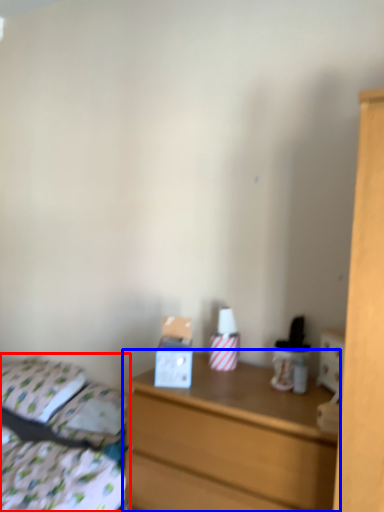
Question: Among these objects, which one is farthest to the camera, bed (highlighted by a red box) or chest of drawers (highlighted by a blue box)?

Choices:
 (A) bed
 (B) chest of drawers

Answer: (B)